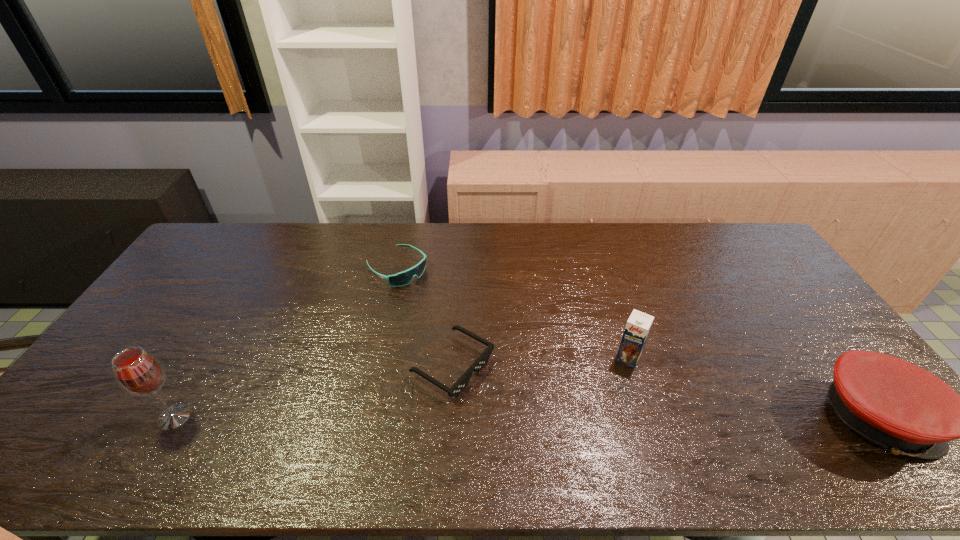
The height and width of the screenshot is (540, 960). What are the coordinates of `wineglass` in the screenshot? It's located at (137, 372).

Identify the location of the leftmost object. The image size is (960, 540). (137, 372).

Where is `the fourth tallest object`? The height and width of the screenshot is (540, 960). the fourth tallest object is located at coordinates (403, 278).

Find the location of a particular element. The height and width of the screenshot is (540, 960). the taller sunglasses is located at coordinates (403, 278).

You are a GUI agent. You are given a task and a screenshot of the screen. Output one action in this format:
    pyautogui.click(x=<x>, y=<y>)
    Task: Click on the shorter sunglasses
    Image resolution: width=960 pixels, height=540 pixels.
    Given the screenshot: What is the action you would take?
    pyautogui.click(x=481, y=361)

Identify the location of the shortest object. (481, 361).

Identify the location of chocolate milk. The image size is (960, 540). (637, 328).

You are a GUI agent. You are given a task and a screenshot of the screen. Output one action in this format:
    pyautogui.click(x=<x>, y=<y>)
    Task: Click on the fourth shortest object
    The image size is (960, 540).
    Given the screenshot: What is the action you would take?
    pyautogui.click(x=637, y=328)

Locate an element on the screen. The width and height of the screenshot is (960, 540). blank area located on the back of the wineglass is located at coordinates (234, 315).

Where is `free space located 0.230m on the front-facing side of the fourth tallest object`? This screenshot has height=540, width=960. free space located 0.230m on the front-facing side of the fourth tallest object is located at coordinates (462, 319).